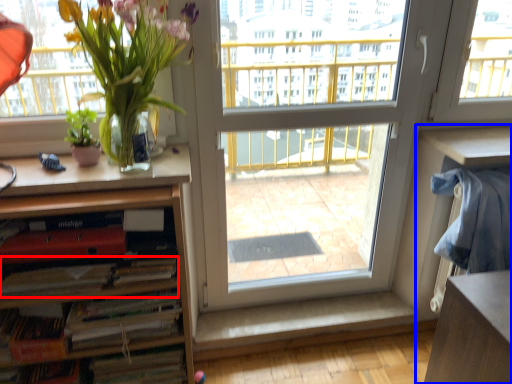
Question: Among these objects, which one is nearest to the camera, book (highlighted by a red box) or computer desk (highlighted by a blue box)?

Choices:
 (A) book
 (B) computer desk

Answer: (A)